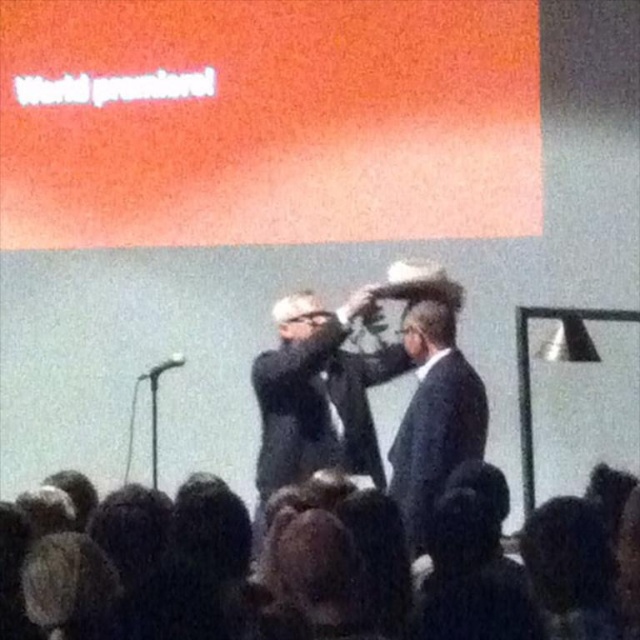
Question: Can you confirm if dark hair at lower center is positioned to the left of black suit at center?

Choices:
 (A) no
 (B) yes

Answer: (A)

Question: Does dark hair at lower center have a greater width compared to satin black suit at center?

Choices:
 (A) no
 (B) yes

Answer: (B)

Question: Estimate the real-world distances between objects in this image. Which object is closer to the satin black suit at center?

Choices:
 (A) black suit at center
 (B) dark hair at lower center

Answer: (A)

Question: Which point is closer to the camera?

Choices:
 (A) (209, 563)
 (B) (410, 461)
 (C) (396, 369)

Answer: (A)

Question: Is dark hair at lower center to the left of black suit at center from the viewer's perspective?

Choices:
 (A) no
 (B) yes

Answer: (A)

Question: Among these points, which one is farthest from the camera?

Choices:
 (A) pos(412,420)
 (B) pos(330,356)
 (C) pos(404,579)

Answer: (B)